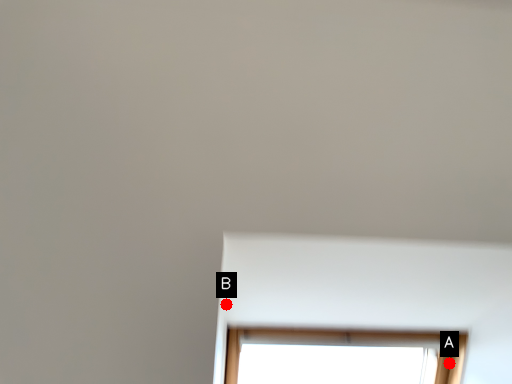
Question: Two points are circled on the image, labeled by A and B beside each circle. Which point is closer to the camera?

Choices:
 (A) A is closer
 (B) B is closer

Answer: (B)